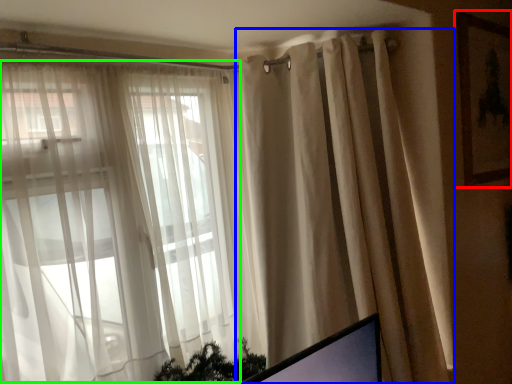
Question: Which is farther away from picture frame (highlighted by a red box)? curtain (highlighted by a blue box) or bay window (highlighted by a green box)?

Choices:
 (A) curtain
 (B) bay window

Answer: (B)